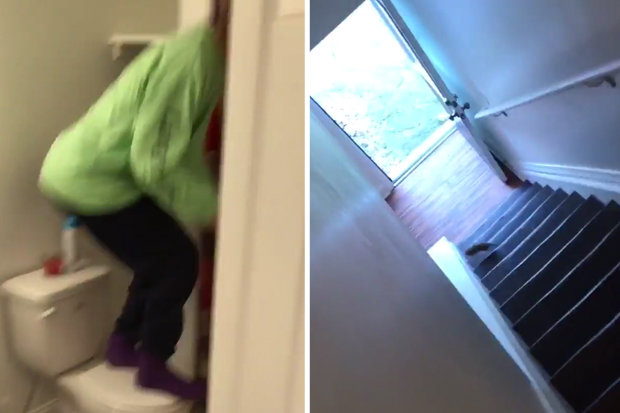
Locate an element on the screen. handrail is located at coordinates (547, 92).